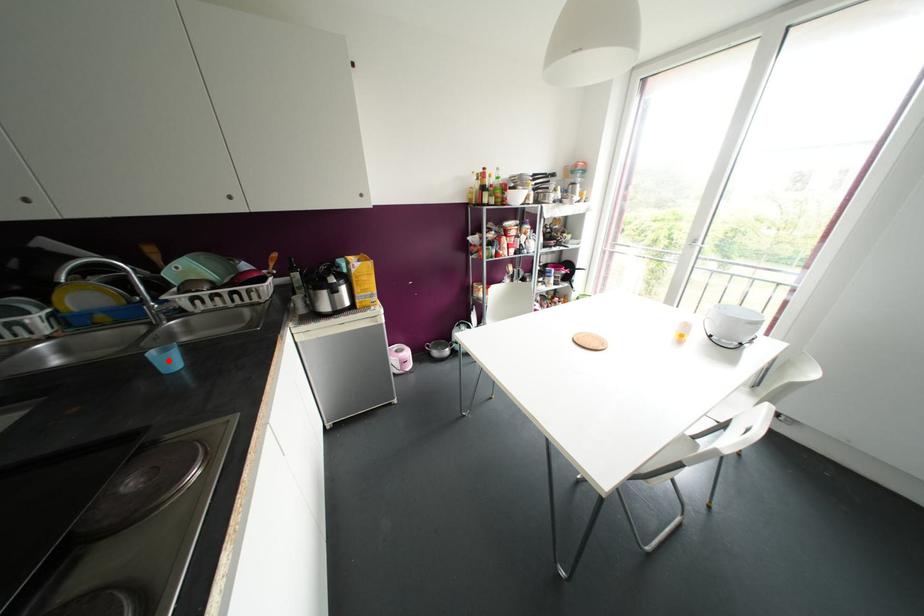
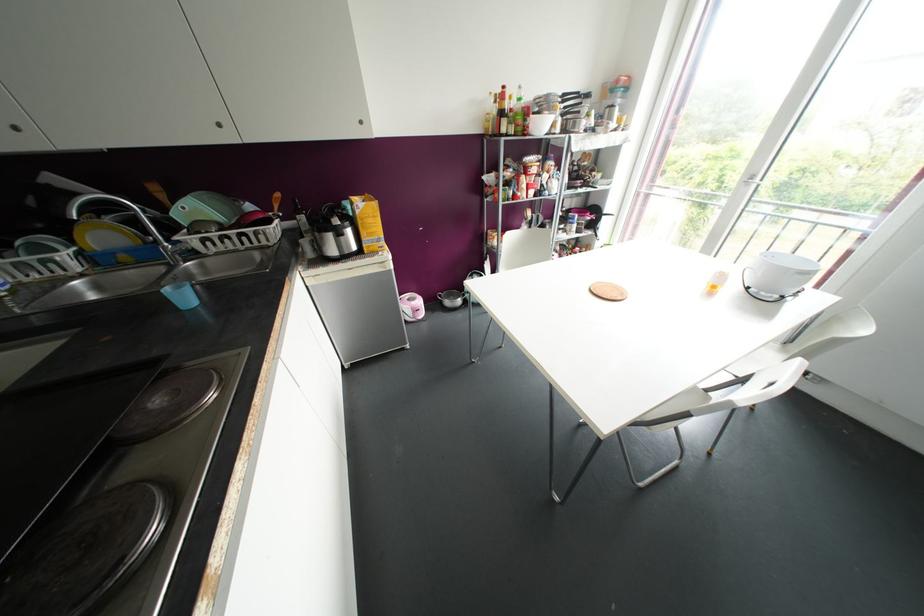
Find the pixel in the second image that matches the highlighted location in the first image.

(184, 297)